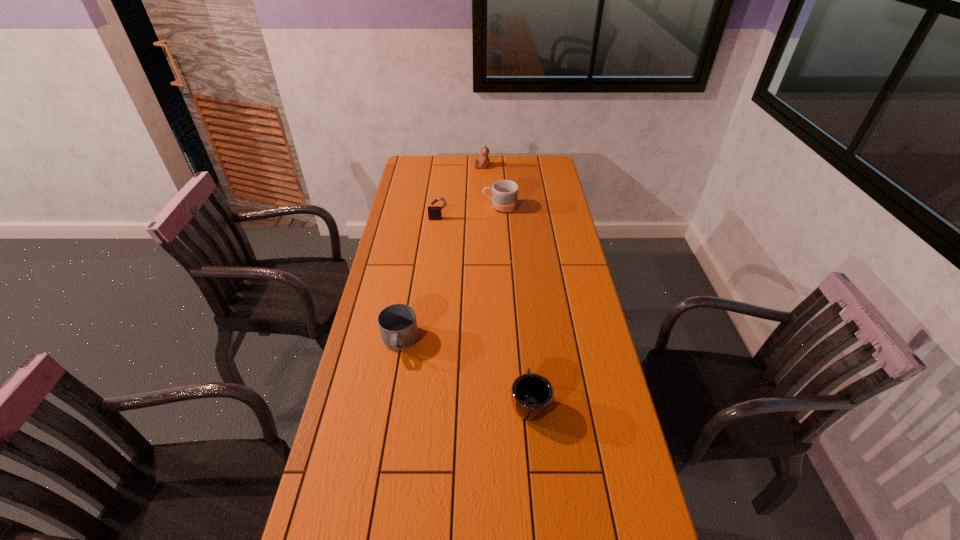
Image resolution: width=960 pixels, height=540 pixels. In order to click on vacant point at the left edge in this screenshot , I will do `click(417, 275)`.

Find the location of a particular element. vacant space at the right edge of the desktop is located at coordinates (541, 204).

What are the coordinates of `free space at the far right corner of the desktop` in the screenshot? It's located at click(x=549, y=167).

You are a GUI agent. You are given a task and a screenshot of the screen. Output one action in this format:
    pyautogui.click(x=<x>, y=<y>)
    Task: Click on the free space between the nearest mug and the fourth nearest object
    The image size is (960, 540).
    Given the screenshot: What is the action you would take?
    pyautogui.click(x=515, y=305)

Where is `vacant space that is in between the second farthest object and the farthest object`? vacant space that is in between the second farthest object and the farthest object is located at coordinates (491, 187).

The image size is (960, 540). Find the location of `free space between the nearest mug and the farthest mug`. free space between the nearest mug and the farthest mug is located at coordinates (515, 305).

Locate an element on the screen. Image resolution: width=960 pixels, height=540 pixels. vacant area between the fourth farthest object and the fourth nearest object is located at coordinates (449, 274).

Identify the location of vacant space that is in between the teddy bear and the farthest mug. This screenshot has width=960, height=540. (491, 187).

The image size is (960, 540). Identify the location of free space that is in between the padlock and the second farthest object. (469, 213).

I want to click on vacant point located between the third farthest object and the farthest object, so click(x=460, y=193).